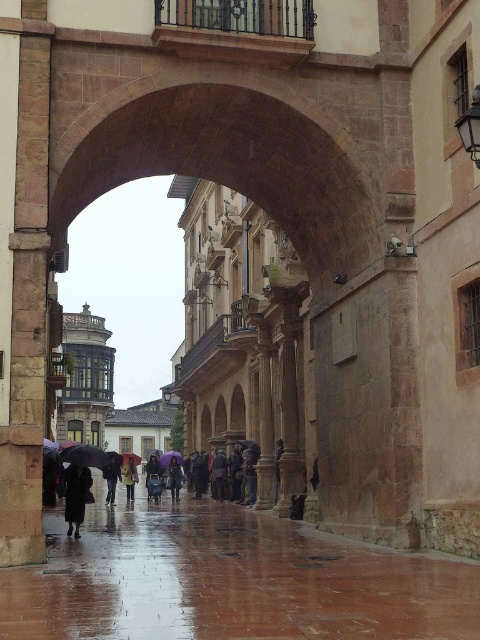
Question: In this image, where is dark brown leather coat at center located relative to blue fabric umbrella at center?

Choices:
 (A) right
 (B) left

Answer: (A)

Question: Which object is positioned closest to the black matte coat at center?

Choices:
 (A) black matte umbrella at center
 (B) dark brown leather coat at center
 (C) yellow fabric umbrella at center

Answer: (A)

Question: Which object is farther from the camera taking this photo?

Choices:
 (A) shiny brown pavement at center
 (B) black matte umbrella at center

Answer: (B)

Question: Which of the following is the farthest from the observer?

Choices:
 (A) (326, 570)
 (B) (168, 476)
 (C) (180, 464)

Answer: (B)

Question: Observing the image, what is the correct spatial positioning of dark brown leather coat at center in reference to dark blue fabric umbrella at center?

Choices:
 (A) right
 (B) left

Answer: (B)

Question: Does dark brown leather coat at center appear on the left side of blue fabric umbrella at center?

Choices:
 (A) yes
 (B) no

Answer: (B)